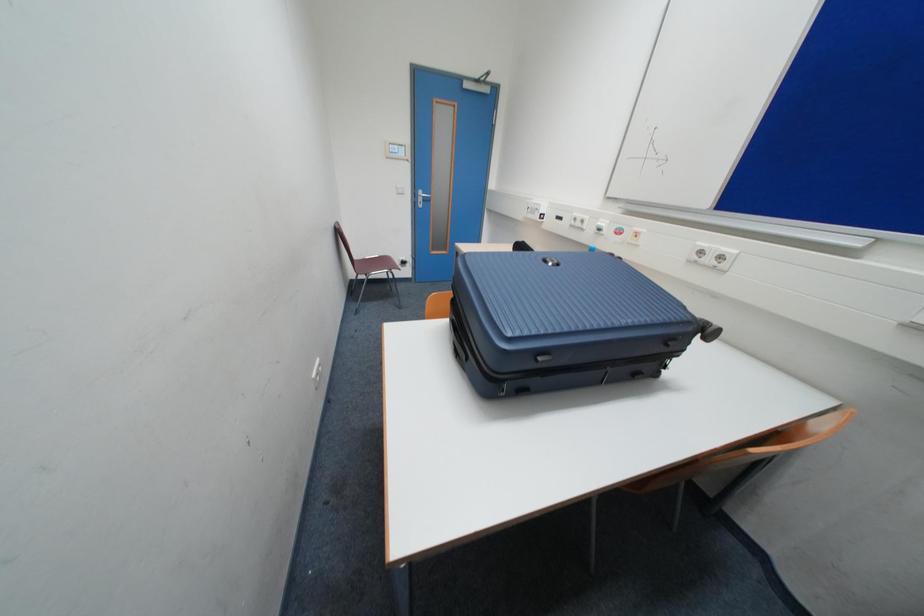
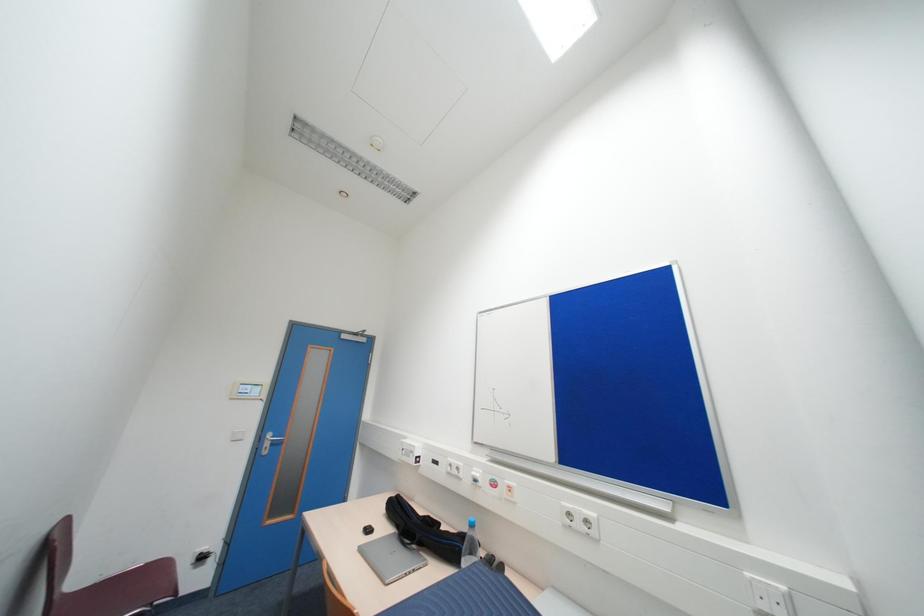
How did the camera likely rotate?

The camera rotated toward right-up.